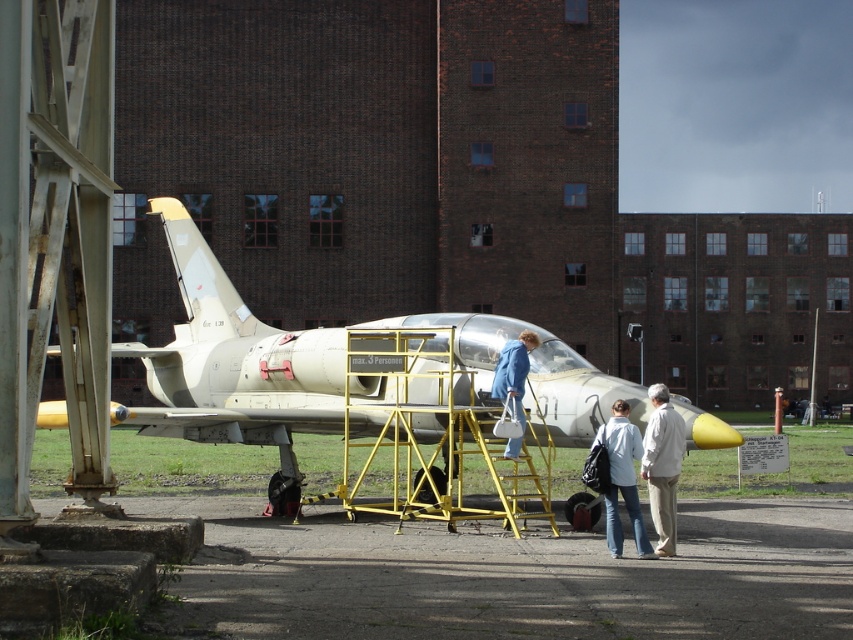
You are a maintenance worker standing next to the matte white airplane at center and the white cotton shirt at lower right. You need to determine if the airplane is wider than the shirt. Can you confirm this?

The matte white airplane at center might be wider than white cotton shirt at lower right, so it is possible that the airplane is wider than the shirt.